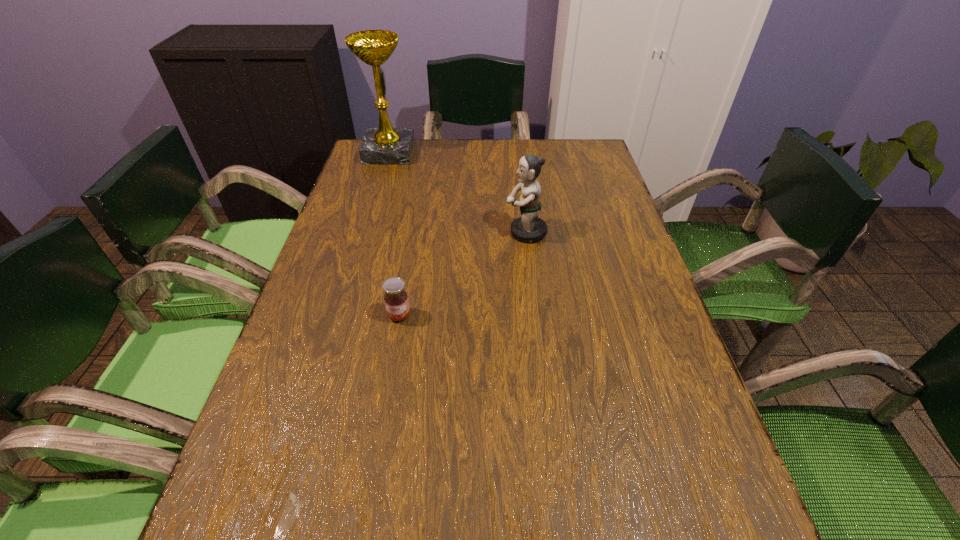
You are a GUI agent. You are given a task and a screenshot of the screen. Output one action in this format:
    pyautogui.click(x=<x>, y=<y>)
    Task: Click on the free location located 0.090m on the label side of the jam
    
    Given the screenshot: What is the action you would take?
    pyautogui.click(x=392, y=360)

The height and width of the screenshot is (540, 960). I want to click on object that is at the far edge, so click(x=385, y=145).

The height and width of the screenshot is (540, 960). In order to click on object located at the left edge in this screenshot , I will do `click(385, 145)`.

Identify the location of object that is at the far left corner. pos(385,145).

You are a GUI agent. You are given a task and a screenshot of the screen. Output one action in this format:
    pyautogui.click(x=<x>, y=<y>)
    Task: Click on the vacant region at the far edge of the desktop
    This screenshot has height=540, width=960.
    Given the screenshot: What is the action you would take?
    pyautogui.click(x=438, y=151)

This screenshot has height=540, width=960. In the image, there is a desktop. Find the location of `free space at the left edge`. free space at the left edge is located at coordinates (346, 270).

Image resolution: width=960 pixels, height=540 pixels. Find the location of `blank space at the right edge of the desktop`. blank space at the right edge of the desktop is located at coordinates (590, 231).

I want to click on blank region between the shortest object and the farthest object, so click(395, 234).

The image size is (960, 540). I want to click on free space between the rightmost object and the second object from left to right, so click(x=463, y=274).

In order to click on free area in between the jam and the second nearest object in this screenshot , I will do `click(463, 274)`.